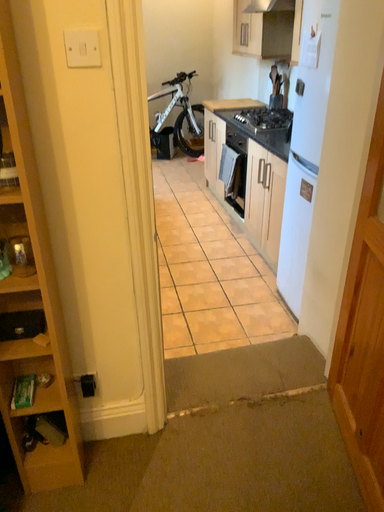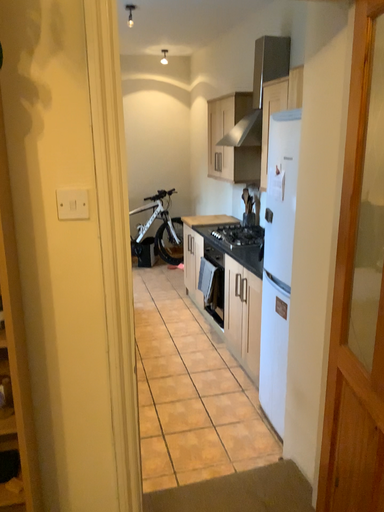
Question: Which way did the camera rotate in the video?

Choices:
 (A) rotated upward
 (B) rotated downward

Answer: (A)